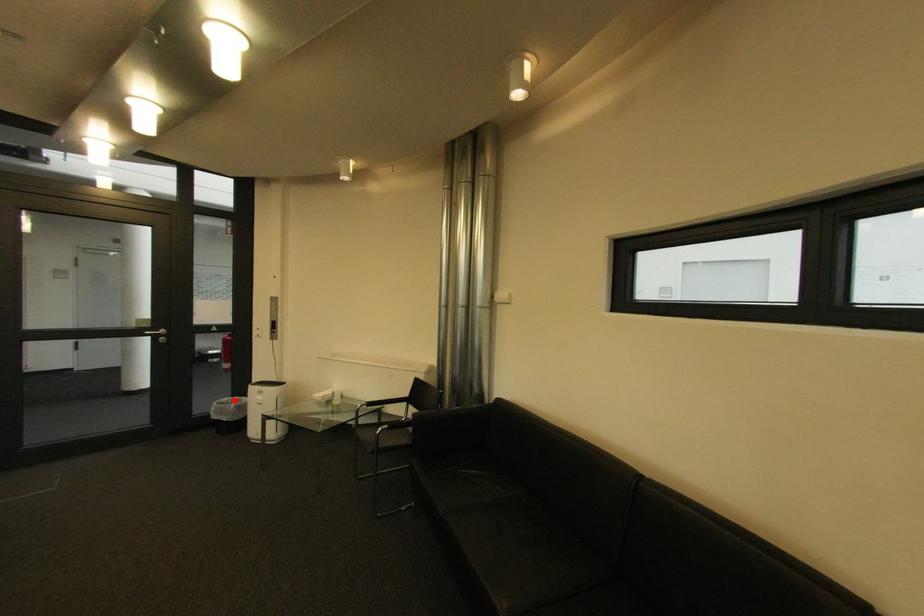
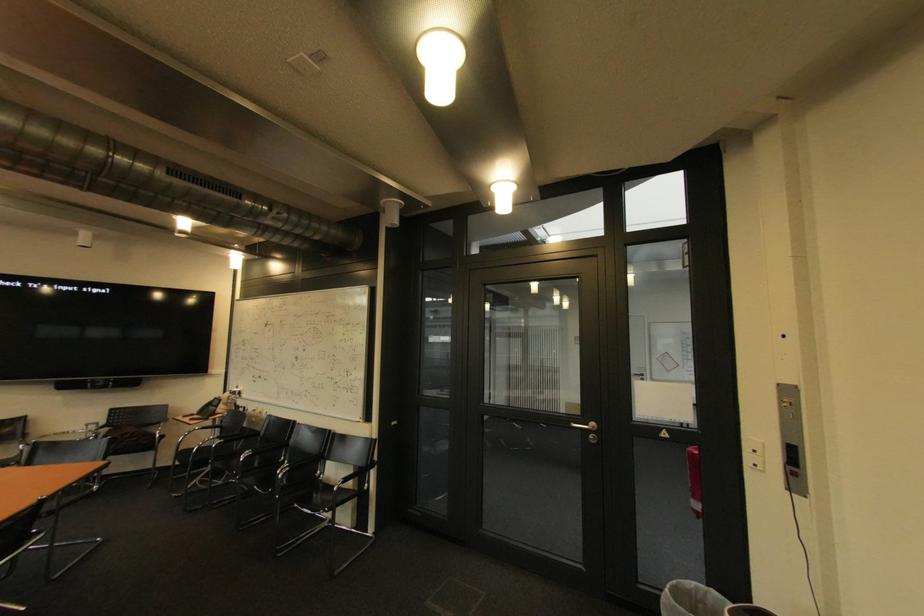
The point at the highlighted location is marked in the first image. Where is the corresponding point in the second image?

(701, 585)